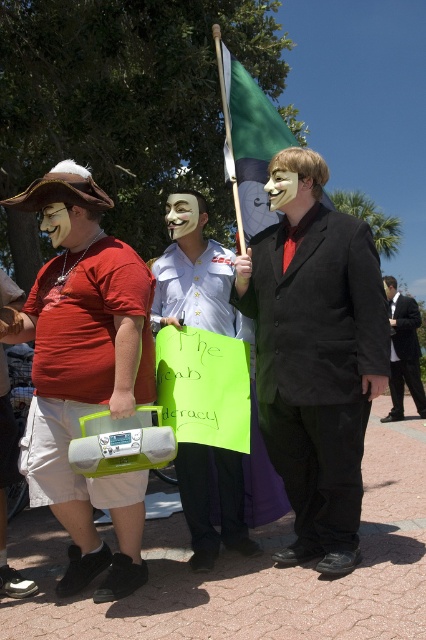
Can you confirm if matte black suit at center is thinner than matte white mask at center?

No, matte black suit at center is not thinner than matte white mask at center.

Describe the element at coordinates (316, 358) in the screenshot. The image size is (426, 640). I see `matte black suit at center` at that location.

Who is more distant from viewer, (302, 561) or (69, 225)?

Point (302, 561)

Find the location of a particular element. Image resolution: width=426 pixels, height=640 pixels. matte black suit at center is located at coordinates (316, 358).

Does matte black suit at center lie behind white glossy mask at center?

No, it is in front of white glossy mask at center.

Does matte black suit at center have a smaller size compared to white glossy mask at center?

Actually, matte black suit at center might be larger than white glossy mask at center.

This screenshot has width=426, height=640. Find the location of `matte black suit at center`. matte black suit at center is located at coordinates (316, 358).

Who is positioned more to the left, black suit at center or matte black mask at center?

Positioned to the left is matte black mask at center.

Which is in front, point (405, 353) or point (279, 176)?

Positioned in front is point (279, 176).

Between point (403, 336) and point (271, 170), which one is positioned in front?

Point (271, 170)

This screenshot has height=640, width=426. Identify the location of black suit at center. (403, 352).